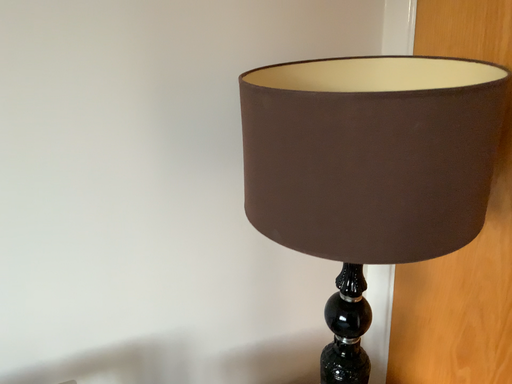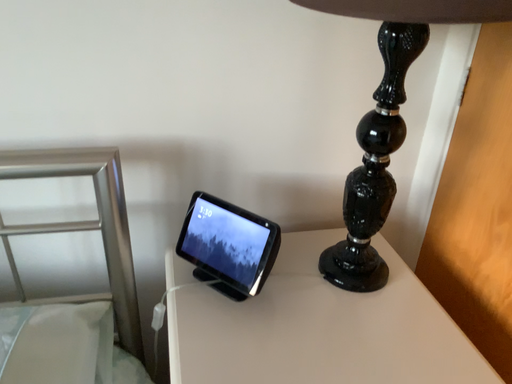
Question: How did the camera likely rotate when shooting the video?

Choices:
 (A) rotated upward
 (B) rotated downward

Answer: (B)